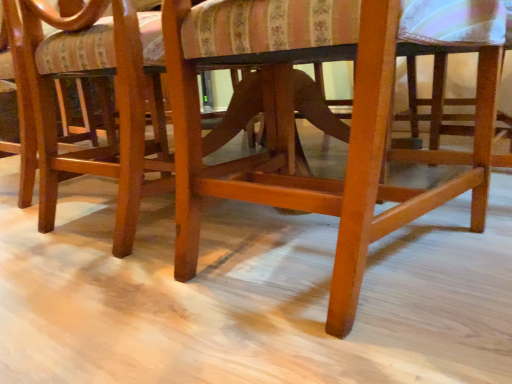
Question: Choose the correct answer: Is glossy wood chair at center, positioned as the second chair in right-to-left order, inside wooden chair at center, which is the first chair from right to left, or outside it?

Choices:
 (A) inside
 (B) outside

Answer: (B)

Question: Is glossy wood chair at center, the 1th chair from the left, bigger or smaller than wooden chair at center, which is the first chair from right to left?

Choices:
 (A) small
 (B) big

Answer: (B)

Question: From a real-world perspective, is glossy wood chair at center, positioned as the second chair in right-to-left order, above or below wooden chair at center, which is the first chair from right to left?

Choices:
 (A) below
 (B) above

Answer: (B)

Question: In the image, is wooden chair at center, positioned as the second chair in left-to-right order, on the left side or the right side of glossy wood chair at center, the 1th chair from the left?

Choices:
 (A) right
 (B) left

Answer: (A)

Question: Is wooden chair at center, positioned as the second chair in left-to-right order, wider or thinner than glossy wood chair at center, the 1th chair from the left?

Choices:
 (A) thin
 (B) wide

Answer: (B)

Question: Is wooden chair at center, which is the first chair from right to left, in front of or behind glossy wood chair at center, positioned as the second chair in right-to-left order, in the image?

Choices:
 (A) behind
 (B) front

Answer: (B)

Question: Looking at the image, does wooden chair at center, which is the first chair from right to left, seem bigger or smaller compared to glossy wood chair at center, the 1th chair from the left?

Choices:
 (A) big
 (B) small

Answer: (B)